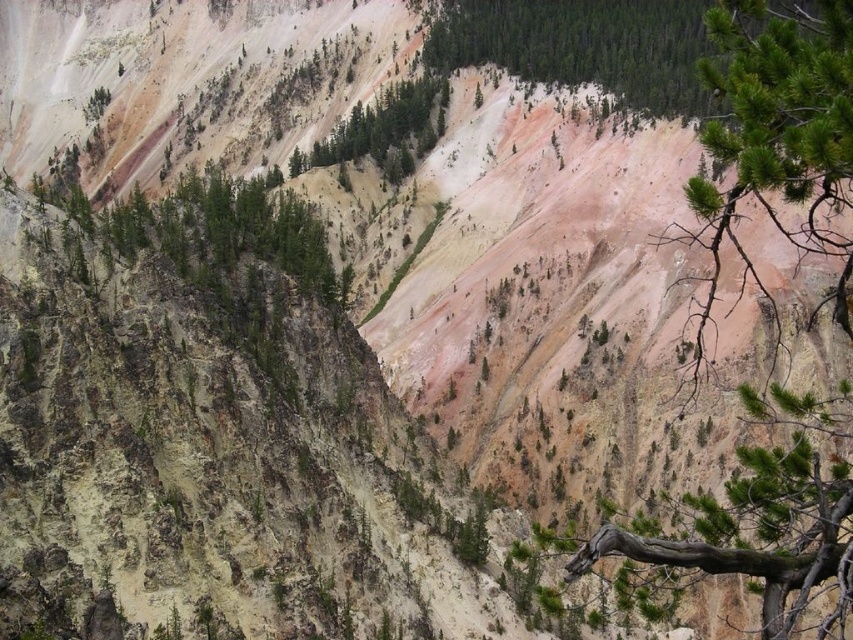
Question: Is green textured pine branch at upper right below green textured tree at center?

Choices:
 (A) yes
 (B) no

Answer: (A)

Question: Among these objects, which one is farthest from the camera?

Choices:
 (A) green textured pine branch at upper right
 (B) green textured tree at center

Answer: (B)

Question: Does green textured pine branch at upper right have a larger size compared to green textured tree at center?

Choices:
 (A) yes
 (B) no

Answer: (A)

Question: Which of the following is the farthest from the observer?

Choices:
 (A) (349, 131)
 (B) (730, 244)

Answer: (A)

Question: Does green textured pine branch at upper right lie in front of green textured tree at center?

Choices:
 (A) no
 (B) yes

Answer: (B)